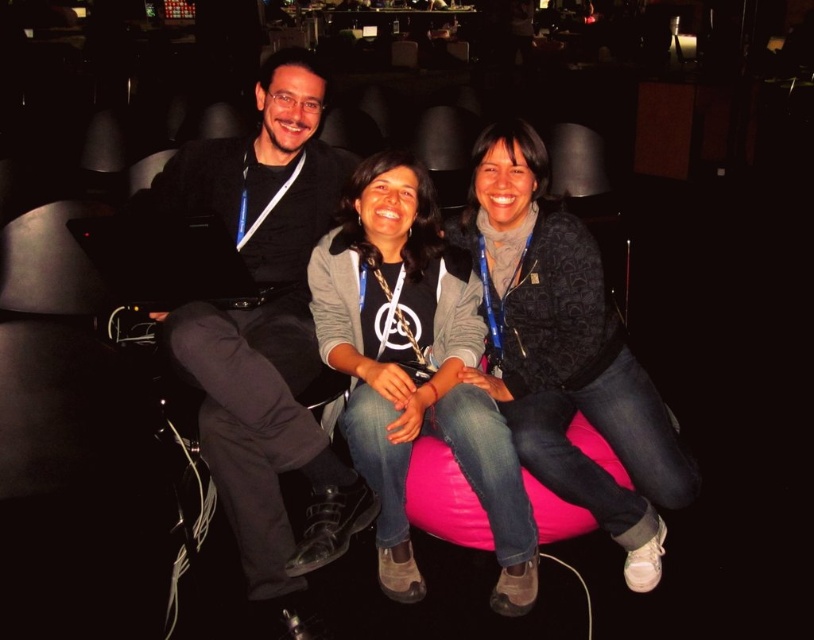
Between point (191, 369) and point (410, 394), which one is positioned behind?

The point (410, 394) is more distant.

Between point (184, 316) and point (454, 323), which one is positioned behind?

The point (454, 323) is behind.

Locate an element on the screen. Image resolution: width=814 pixels, height=640 pixels. black matte jacket at upper left is located at coordinates (265, 330).

Between matte black jacket at center and pink fabric bean bag at center, which one is positioned higher?

Positioned higher is matte black jacket at center.

Which is behind, point (541, 460) or point (575, 531)?

The point (575, 531) is more distant.

Who is more forward, [668,458] or [445,490]?

Positioned in front is point [668,458].

Where is `matte black jacket at center`? The height and width of the screenshot is (640, 814). matte black jacket at center is located at coordinates (565, 353).

Can you confirm if black matte jacket at upper left is thinner than matte black jacket at center?

Incorrect, black matte jacket at upper left's width is not less than matte black jacket at center's.

What do you see at coordinates (265, 330) in the screenshot?
I see `black matte jacket at upper left` at bounding box center [265, 330].

You are a GUI agent. You are given a task and a screenshot of the screen. Output one action in this format:
    pyautogui.click(x=<x>, y=<y>)
    Task: Click on the black matte jacket at upper left
    The width and height of the screenshot is (814, 640).
    Given the screenshot: What is the action you would take?
    pyautogui.click(x=265, y=330)